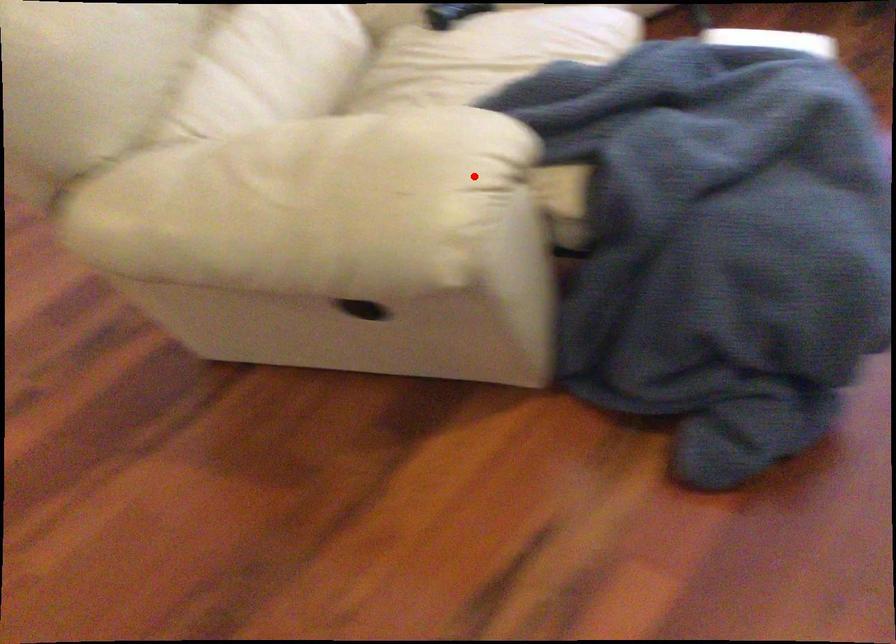
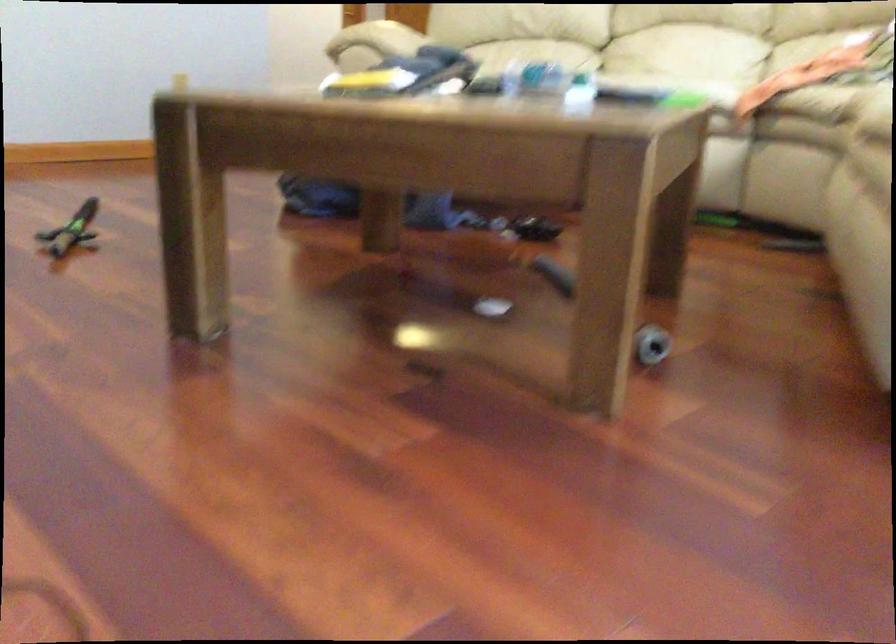
Question: I am providing you with two images of the same scene from different viewpoints. Image1 has a red point marked. In image2, the corresponding 3D location appears at what relative position? Reply with the corresponding letter.

Choices:
 (A) Closer
 (B) Farther

Answer: (B)